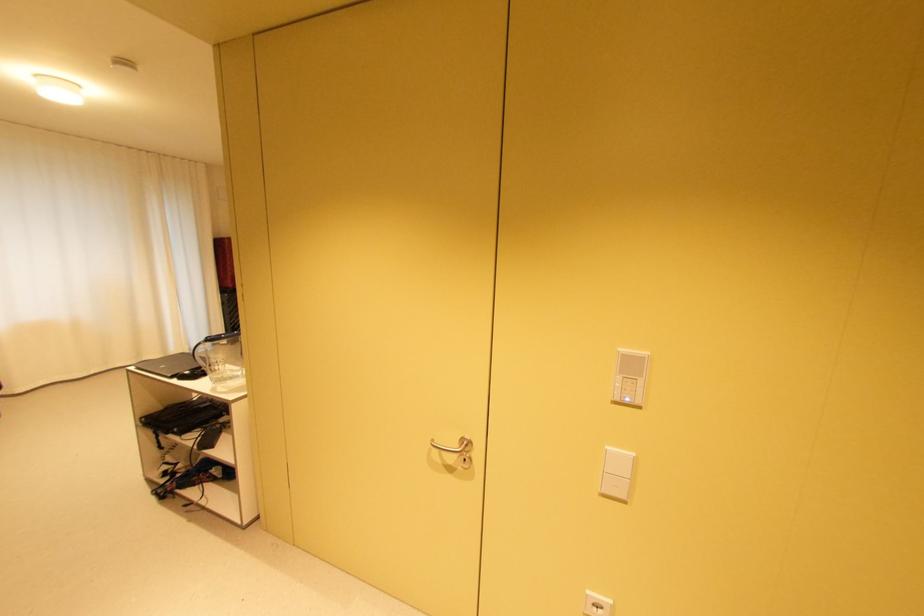
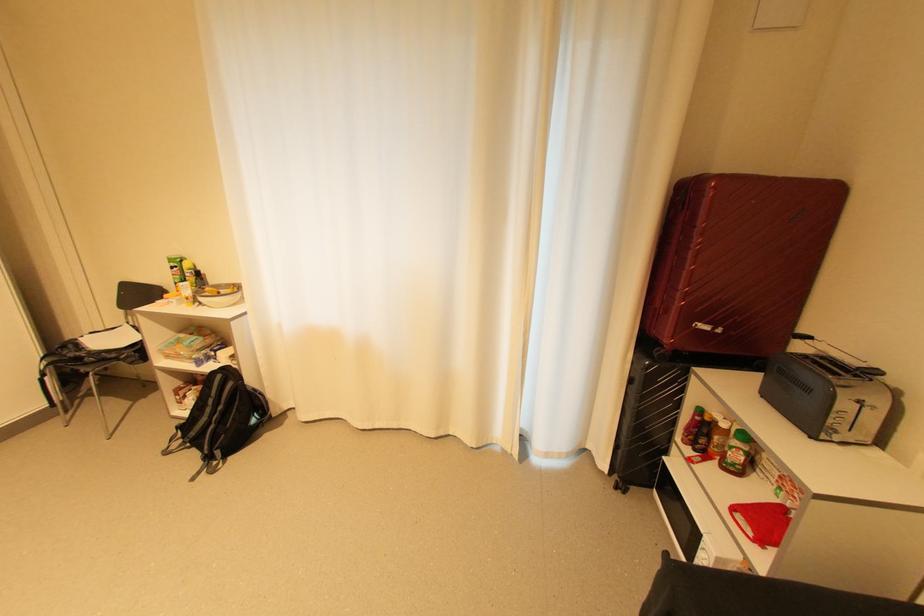
Where in the second image is the point corresponding to (x=232, y=304) from the first image?

(638, 381)